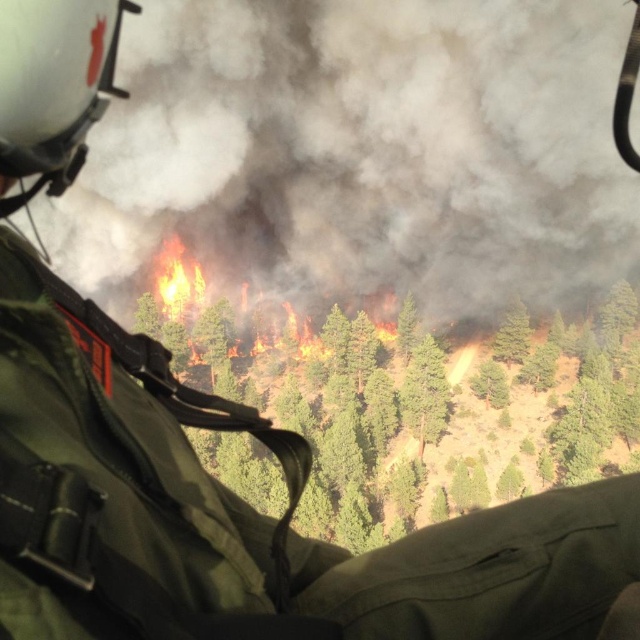
You are a firefighter in a helicopter trying to locate the white matte helmet at upper left. The pilot says you must drop a water bucket at point (52, 84). Is the white matte helmet at upper left in the way of the bucket drop?

The white matte helmet at upper left is located at point (52, 84), so yes, the white matte helmet at upper left is exactly at the drop point and would be in the way of the bucket drop.

You are a firefighter in a helicopter trying to assess the situation. You notice the white matte helmet at upper left and the flaming orange fire at center. Based on their positions, can you estimate how far apart they are from each other?

The distance between the white matte helmet at upper left and the flaming orange fire at center is 379.29 feet.